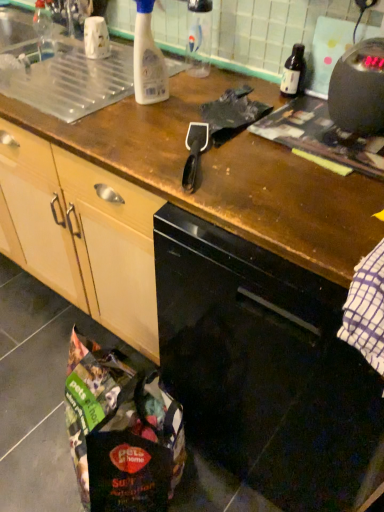
This screenshot has width=384, height=512. Identify the location of vacant area that lies in front of translucent glass bottle at upper right, acting as the 1th bottle starting from the right. (294, 125).